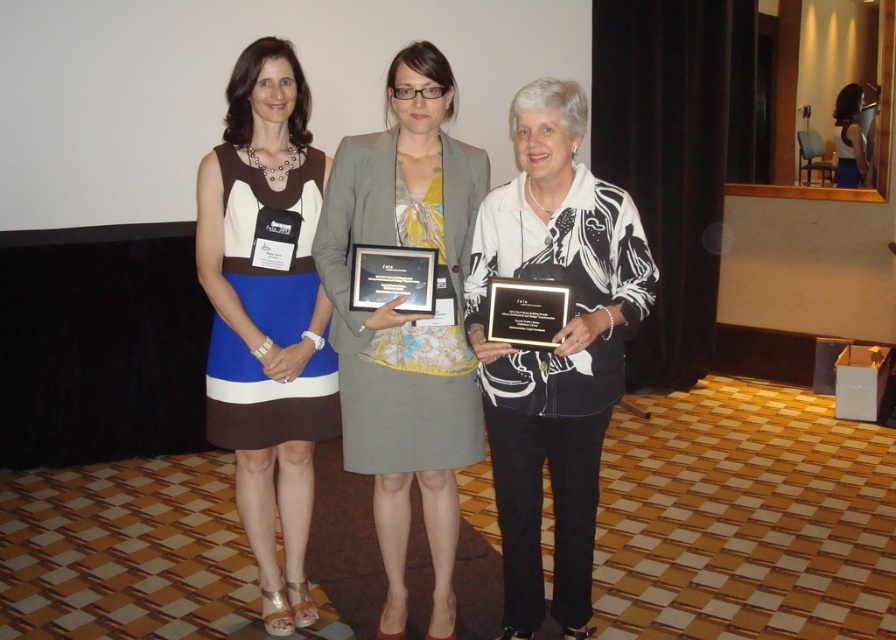
What is located at the point with coordinates [553,348] in the image?

The point at coordinates [553,348] indicates white printed fabric at center.

You are taking a photo of two points in a room. The first point is at coordinates point (426, 390) and the second is at point (209, 426). Which point is closer to the camera?

Point (426, 390) is closer to the camera than point (209, 426).

You are a photographer trying to capture a group photo of the white printed fabric at center and the blue fabric dress at left. The camera you are using has a minimum focus distance of 30 inches. Can you focus on both objects simultaneously without moving the camera?

The distance between the white printed fabric at center and the blue fabric dress at left is 29.69 inches, which is less than the camera minimum focus distance of 30 inches. Therefore, you cannot focus on both objects simultaneously without moving the camera.